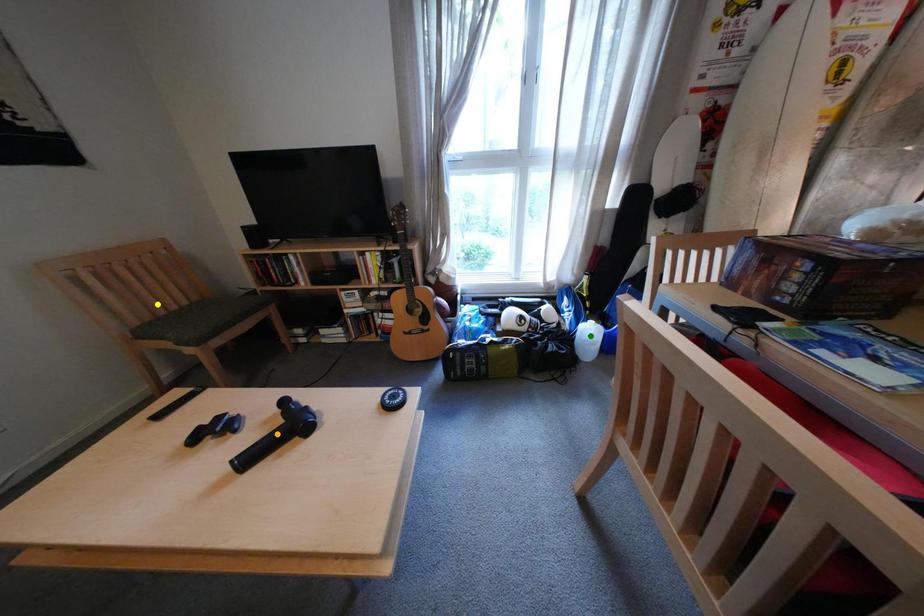
Order these from nearest to farthest:
green point | yellow point | orange point

orange point, yellow point, green point